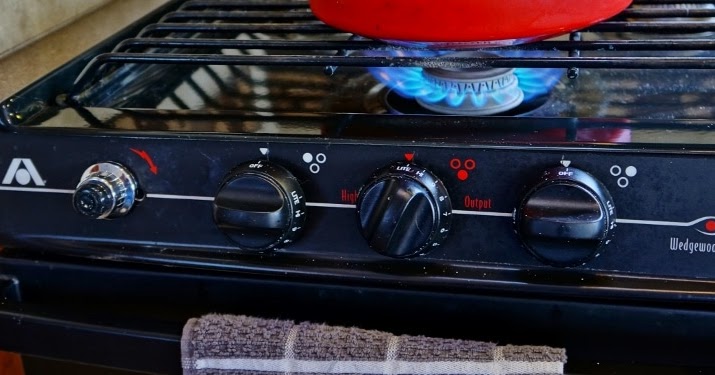
You are a GUI agent. You are given a task and a screenshot of the screen. Output one action in this format:
    pyautogui.click(x=<x>, y=<y>)
    Task: Click on the plastic stove knob
    This screenshot has height=375, width=715.
    Given the screenshot: What is the action you would take?
    pyautogui.click(x=255, y=212), pyautogui.click(x=400, y=206), pyautogui.click(x=562, y=222)